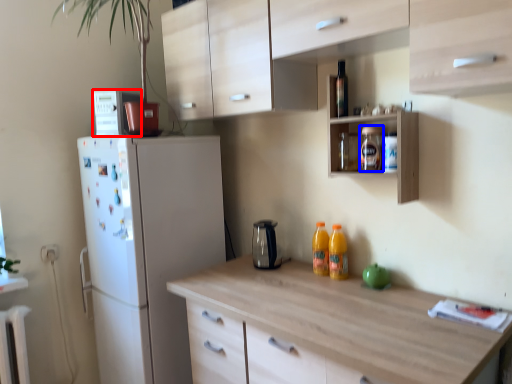
Question: Which object is further to the camera taking this photo, appliance (highlighted by a red box) or bottle (highlighted by a blue box)?

Choices:
 (A) appliance
 (B) bottle

Answer: (A)